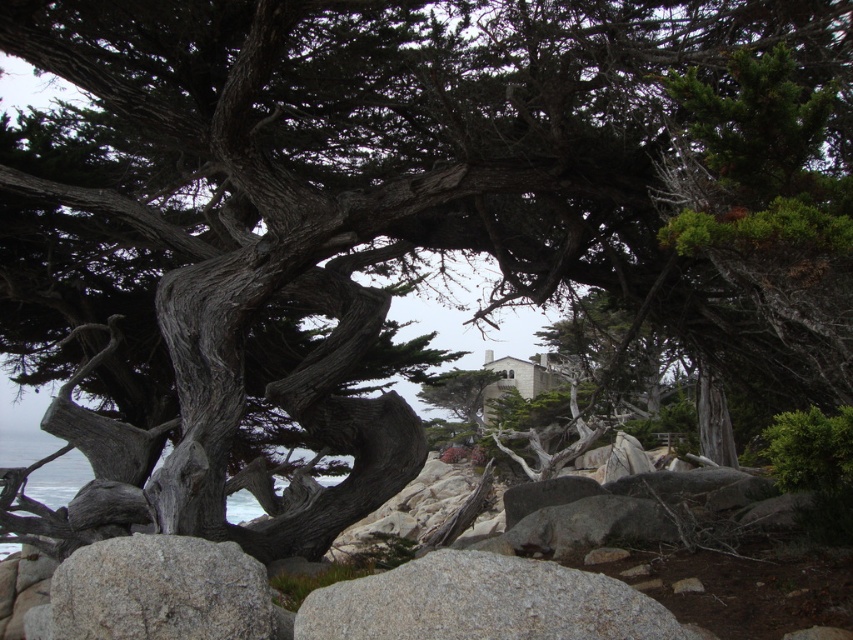
Is point (480, 550) closer to viewer compared to point (115, 554)?

No, (480, 550) is behind (115, 554).

Based on the photo, does gray granite boulder at lower center have a greater width compared to gray rough rock at lower left?

Yes, gray granite boulder at lower center is wider than gray rough rock at lower left.

Is point (573, 605) positioned before point (200, 636)?

Yes, point (573, 605) is closer to viewer.

Identify the location of gray granite boulder at lower center. point(483,604).